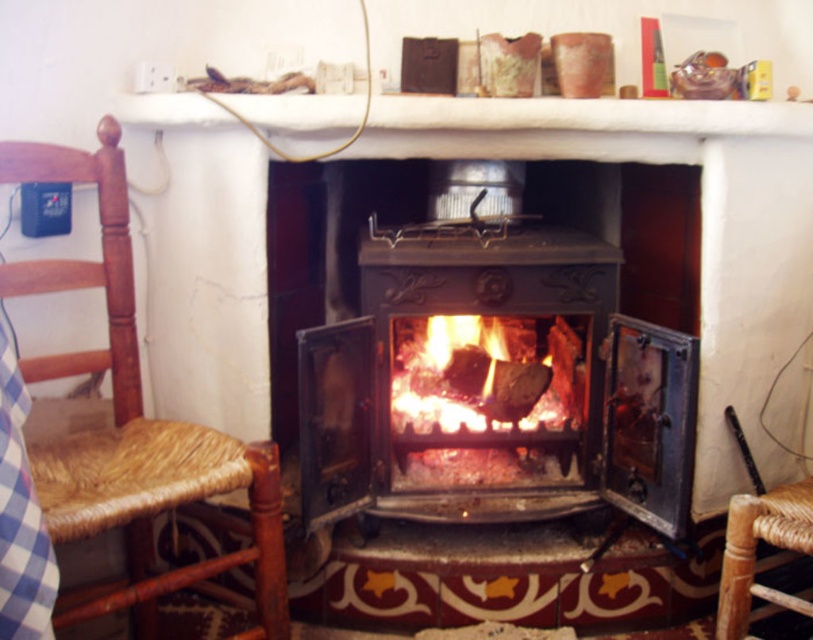
From the picture: You are sitting in the brown wicker rocking chair at left and want to reach an object placed on the charcoal black wood at center. Considering the height difference between the two, will you need to lean forward to reach it?

The brown wicker rocking chair at left is taller than the charcoal black wood at center, so you would need to lean forward to reach the object placed on the charcoal black wood at center.

You are standing in the room and want to place a new painting exactly where the shiny black stove at center is currently located. Is this possible without moving the stove?

The shiny black stove at center is located at coordinates [494,385], so placing a painting there would require moving the stove since they occupy the same space.

You are sitting in the brown wicker rocking chair at left and want to reach the charcoal black wood at center. Considering the size difference between the two objects, which object would require more space to move around?

The brown wicker rocking chair at left is bigger than the charcoal black wood at center, so it would require more space to move around.